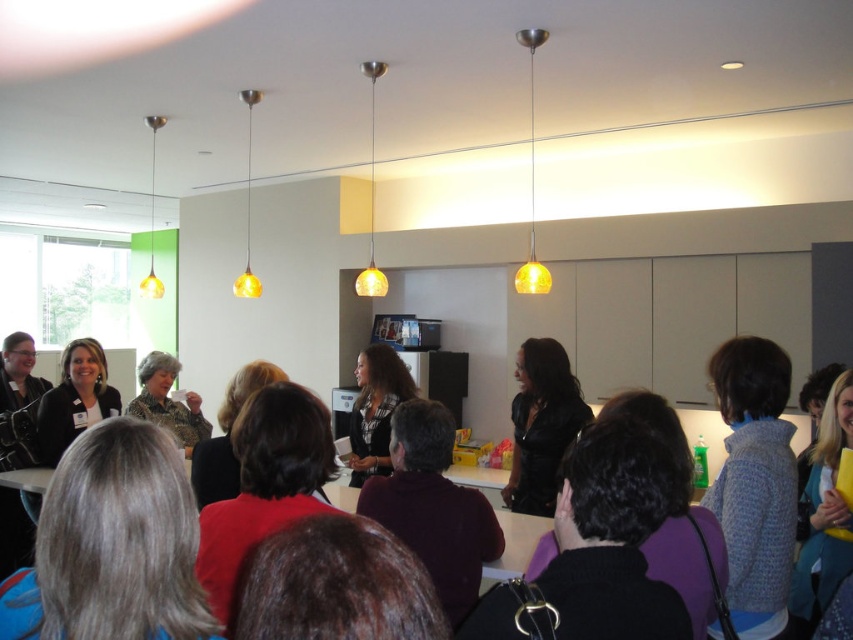
You are sitting at the back of the room and want to see the speaker clearly. Which object from the list is closer to your line of sight? The purple matte sweater at center or the blonde hair at upper right?

The purple matte sweater at center is closer to your line of sight because it is shorter than the blonde hair at upper right, so it would be positioned lower and more directly in front of you.

You are standing at the entrance of the room. The speaker is wearing a purple matte sweater at center. If you want to move closer to the speaker, which direction should you walk? Please provide your answer in terms of the coordinate system where the bottom left corner of the room is the origin point.

Since the purple matte sweater at center is located at coordinate point (433, 506), you should walk towards the right and slightly forward to reach the speaker.

You are sitting at the back of the room and want to look at the speaker with gray hair at center and the amber glass pendant light at upper left. Which object is closer to you?

The gray hair at center is closer to you than the amber glass pendant light at upper left.